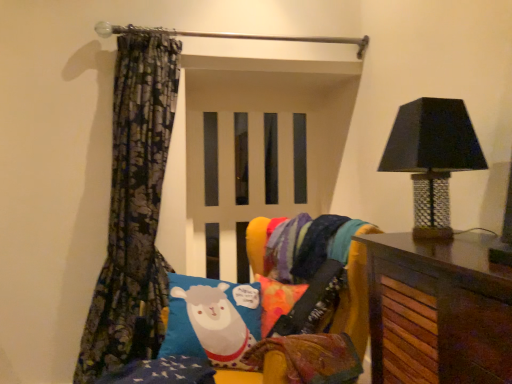
Question: From a real-world perspective, is floral-patterned fabric at left physically located above or below velvet multicolored bean bag chair at center?

Choices:
 (A) above
 (B) below

Answer: (A)

Question: Is floral-patterned fabric at left situated inside velvet multicolored bean bag chair at center or outside?

Choices:
 (A) outside
 (B) inside

Answer: (A)

Question: Estimate the real-world distances between objects in this image. Which object is closer to the velvet multicolored bean bag chair at center?

Choices:
 (A) floral-patterned fabric at left
 (B) blue fabric pillow with sheep design at center
 (C) black mosaic table lamp at right

Answer: (B)

Question: Estimate the real-world distances between objects in this image. Which object is farther from the floral-patterned fabric at left?

Choices:
 (A) black mosaic table lamp at right
 (B) velvet multicolored bean bag chair at center
 (C) blue fabric pillow with sheep design at center

Answer: (A)